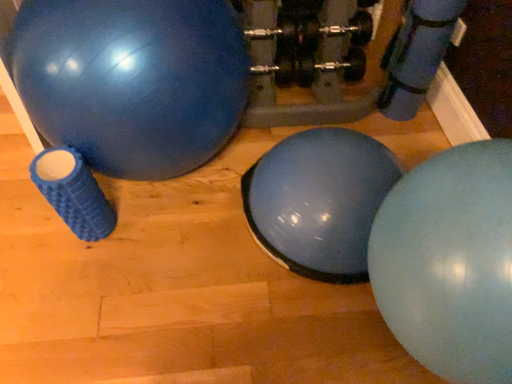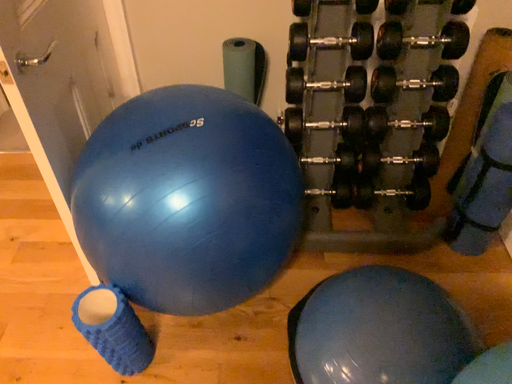
Question: Which way did the camera rotate in the video?

Choices:
 (A) rotated upward
 (B) rotated downward

Answer: (A)